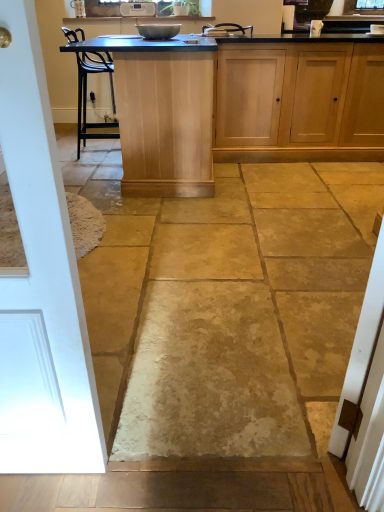
Question: Considering the positions of white painted wood door at left and light wood table at center in the image, is white painted wood door at left wider or thinner than light wood table at center?

Choices:
 (A) wide
 (B) thin

Answer: (B)

Question: In the image, is white painted wood door at left on the left side or the right side of light wood table at center?

Choices:
 (A) left
 (B) right

Answer: (A)

Question: Which object is positioned closest to the metallic bowl at center?

Choices:
 (A) light wood table at center
 (B) white painted wood door at left
 (C) light wood cabinet at center

Answer: (A)

Question: Based on their relative distances, which object is nearer to the white painted wood door at left?

Choices:
 (A) metallic bowl at center
 (B) light wood table at center
 (C) light wood cabinet at center

Answer: (B)